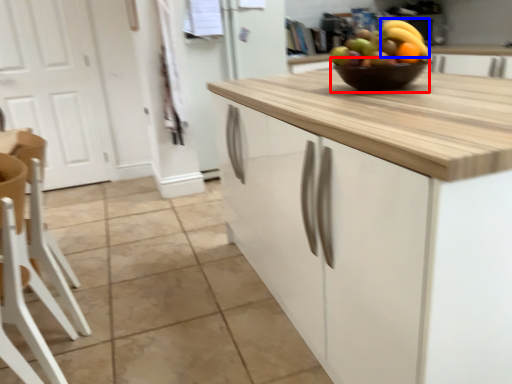
Question: Which of the following is the closest to the observer, glass bowl (highlighted by a red box) or banana (highlighted by a blue box)?

Choices:
 (A) glass bowl
 (B) banana

Answer: (A)